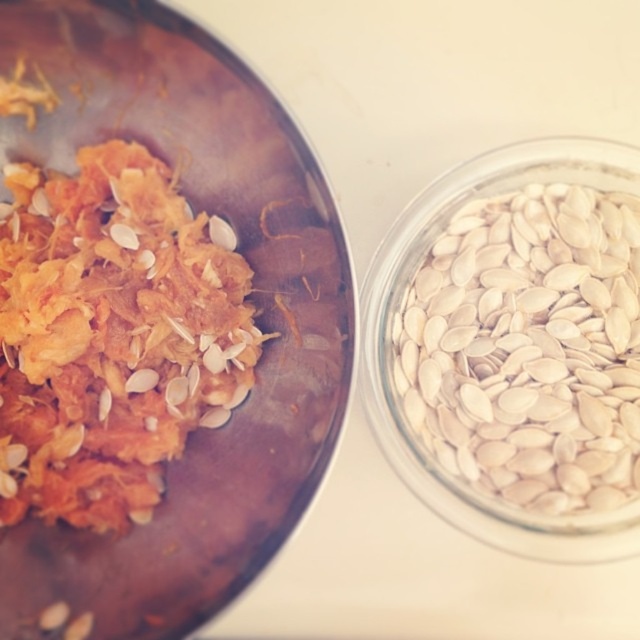
Question: From the image, what is the correct spatial relationship of orange shredded food at left in relation to white smooth pumpkin seeds at right?

Choices:
 (A) below
 (B) above

Answer: (B)

Question: Among these objects, which one is nearest to the camera?

Choices:
 (A) white smooth pumpkin seeds at right
 (B) orange shredded food at left

Answer: (B)

Question: Is orange shredded food at left bigger than white smooth pumpkin seeds at right?

Choices:
 (A) no
 (B) yes

Answer: (B)

Question: Which point is closer to the camera?

Choices:
 (A) (156, 486)
 (B) (497, 442)

Answer: (A)

Question: Does orange shredded food at left appear over white smooth pumpkin seeds at right?

Choices:
 (A) yes
 (B) no

Answer: (A)